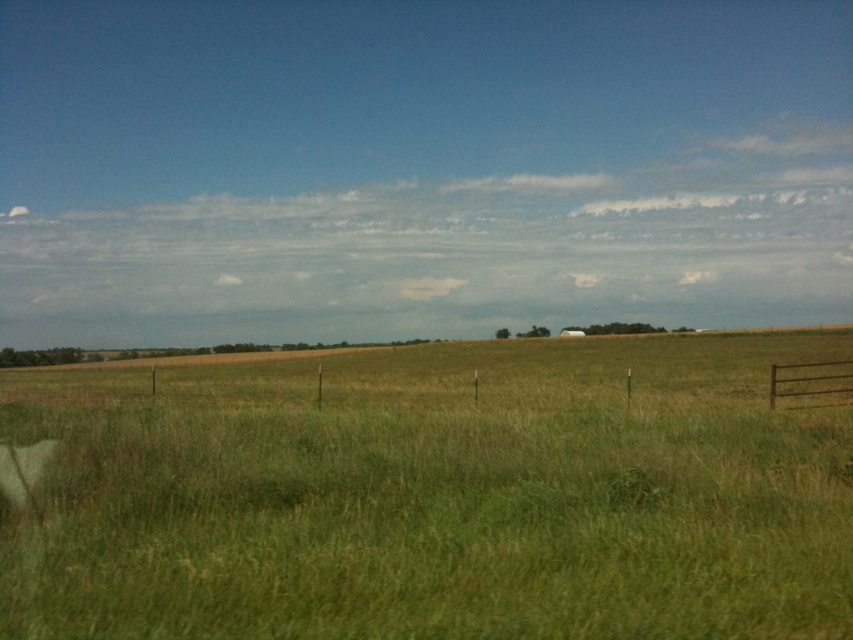
Question: Does green grassy pasture at center appear over rusty metal fence at right?

Choices:
 (A) no
 (B) yes

Answer: (A)

Question: Can you confirm if green grassy pasture at center is positioned above rusty metal fence at right?

Choices:
 (A) no
 (B) yes

Answer: (A)

Question: Does green grassy pasture at center have a smaller size compared to rusty metal fence at right?

Choices:
 (A) yes
 (B) no

Answer: (B)

Question: Which of the following is the closest to the observer?

Choices:
 (A) (837, 364)
 (B) (692, 612)

Answer: (B)

Question: Which point appears closest to the camera in this image?

Choices:
 (A) (223, 458)
 (B) (833, 397)

Answer: (A)